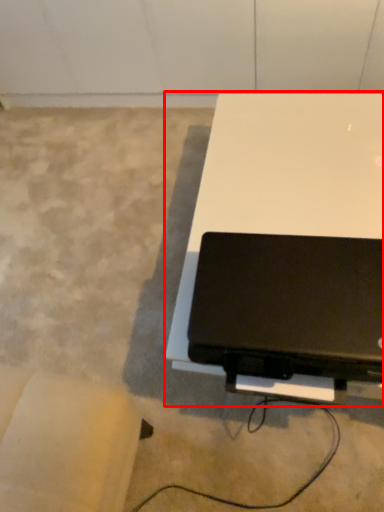
Question: Considering the relative positions of table (annotated by the red box) and laptop in the image provided, where is table (annotated by the red box) located with respect to the staircase?

Choices:
 (A) left
 (B) right

Answer: (B)